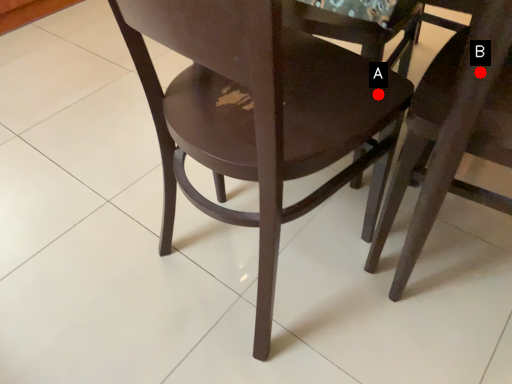
Question: Two points are circled on the image, labeled by A and B beside each circle. Among these points, which one is farthest from the camera?

Choices:
 (A) A is further
 (B) B is further

Answer: (A)